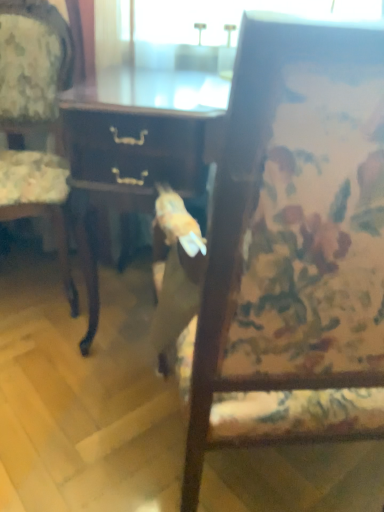
Question: Is wooden desk at center taller or shorter than wooden floral-patterned chair at left, placed as the second chair when sorted from right to left?

Choices:
 (A) short
 (B) tall

Answer: (A)

Question: Considering the positions of point (119, 106) and point (49, 163), is point (119, 106) closer or farther from the camera than point (49, 163)?

Choices:
 (A) farther
 (B) closer

Answer: (B)

Question: Which object is the farthest from the wooden chair at center, which is the 2th chair in left-to-right order?

Choices:
 (A) wooden floral-patterned chair at left, placed as the second chair when sorted from right to left
 (B) wooden desk at center

Answer: (A)

Question: Estimate the real-world distances between objects in this image. Which object is closer to the wooden chair at center, arranged as the first chair when viewed from the right?

Choices:
 (A) wooden floral-patterned chair at left, placed as the second chair when sorted from right to left
 (B) wooden desk at center

Answer: (B)